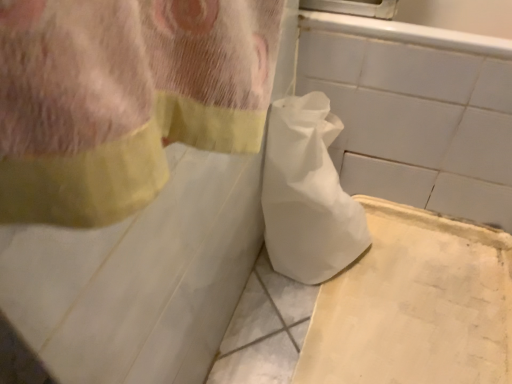
Question: Does point (467, 256) appear closer or farther from the camera than point (305, 152)?

Choices:
 (A) farther
 (B) closer

Answer: (A)

Question: From the image's perspective, is white cardboard at lower right positioned above or below white paper bag at center?

Choices:
 (A) above
 (B) below

Answer: (B)

Question: From a real-world perspective, relative to white paper bag at center, is white cardboard at lower right vertically above or below?

Choices:
 (A) above
 (B) below

Answer: (B)

Question: Is point [330, 233] positioned closer to the camera than point [384, 327]?

Choices:
 (A) farther
 (B) closer

Answer: (A)

Question: From a real-world perspective, is white paper bag at center above or below white cardboard at lower right?

Choices:
 (A) below
 (B) above

Answer: (B)

Question: In terms of width, does white paper bag at center look wider or thinner when compared to white cardboard at lower right?

Choices:
 (A) thin
 (B) wide

Answer: (A)

Question: Is white paper bag at center inside or outside of white cardboard at lower right?

Choices:
 (A) inside
 (B) outside

Answer: (B)